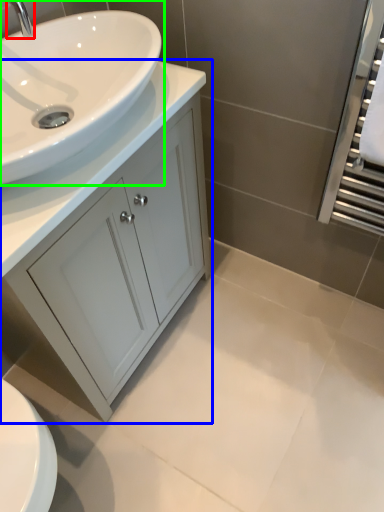
Question: Which object is positioned closest to tap (highlighted by a red box)? Select from bathroom cabinet (highlighted by a blue box) and sink (highlighted by a green box).

Choices:
 (A) bathroom cabinet
 (B) sink

Answer: (B)